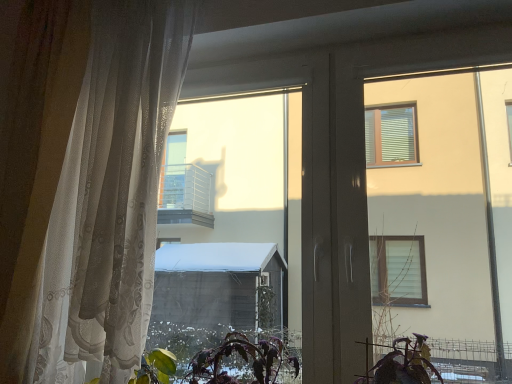
Question: Is the surface of purple matte plant at lower center in direct contact with sheer white curtain at left?

Choices:
 (A) no
 (B) yes

Answer: (A)

Question: Is purple matte plant at lower center to the left of sheer white curtain at left from the viewer's perspective?

Choices:
 (A) no
 (B) yes

Answer: (A)

Question: From a real-world perspective, is purple matte plant at lower center below sheer white curtain at left?

Choices:
 (A) yes
 (B) no

Answer: (A)

Question: Can you confirm if purple matte plant at lower center is positioned to the right of sheer white curtain at left?

Choices:
 (A) yes
 (B) no

Answer: (A)

Question: Is purple matte plant at lower center bigger than sheer white curtain at left?

Choices:
 (A) yes
 (B) no

Answer: (B)

Question: From a real-world perspective, is purple matte plant at lower center physically above sheer white curtain at left?

Choices:
 (A) no
 (B) yes

Answer: (A)

Question: Can you confirm if sheer white curtain at left is bigger than purple matte plant at lower center?

Choices:
 (A) yes
 (B) no

Answer: (A)

Question: Is sheer white curtain at left aimed at purple matte plant at lower center?

Choices:
 (A) no
 (B) yes

Answer: (A)

Question: Is sheer white curtain at left to the right of purple matte plant at lower center from the viewer's perspective?

Choices:
 (A) no
 (B) yes

Answer: (A)

Question: Is sheer white curtain at left to the left of purple matte plant at lower center from the viewer's perspective?

Choices:
 (A) yes
 (B) no

Answer: (A)

Question: Considering the relative sizes of sheer white curtain at left and purple matte plant at lower center in the image provided, is sheer white curtain at left shorter than purple matte plant at lower center?

Choices:
 (A) yes
 (B) no

Answer: (B)

Question: Is sheer white curtain at left surrounding purple matte plant at lower center?

Choices:
 (A) no
 (B) yes

Answer: (A)

Question: Which is correct: purple matte plant at lower center is inside sheer white curtain at left, or outside of it?

Choices:
 (A) inside
 (B) outside

Answer: (B)